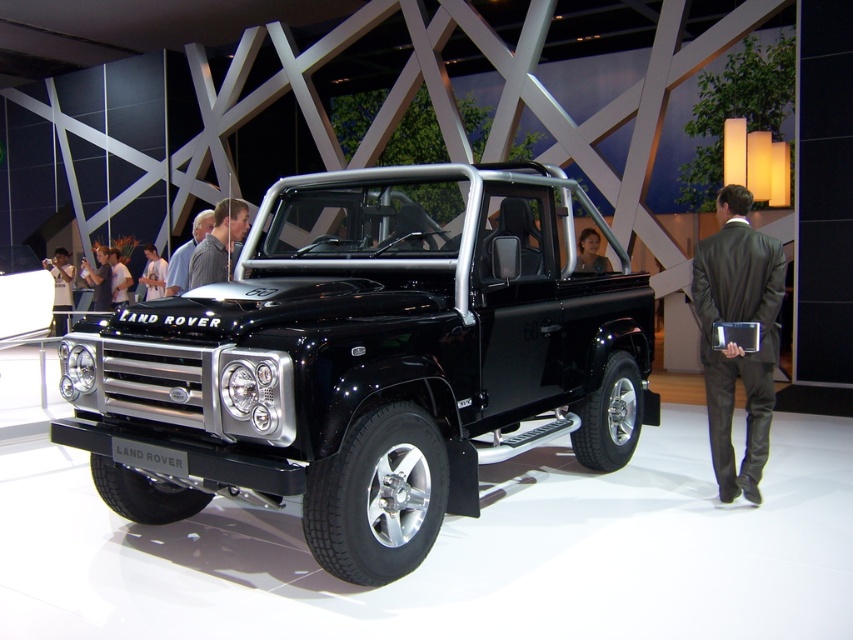
Measure the distance between gray striped shirt at center and white shirt at center.

A distance of 5.92 meters exists between gray striped shirt at center and white shirt at center.

Can you confirm if gray striped shirt at center is wider than white shirt at center?

Correct, the width of gray striped shirt at center exceeds that of white shirt at center.

Does point (164, 292) come in front of point (119, 298)?

Yes, it is.

You are a GUI agent. You are given a task and a screenshot of the screen. Output one action in this format:
    pyautogui.click(x=<x>, y=<y>)
    Task: Click on the gray striped shirt at center
    Image resolution: width=853 pixels, height=640 pixels.
    Given the screenshot: What is the action you would take?
    pyautogui.click(x=186, y=253)

In the scene shown: Between dark gray suit at right and white shirt at center, which one appears on the right side from the viewer's perspective?

Positioned to the right is dark gray suit at right.

Can you confirm if dark gray suit at right is taller than white shirt at center?

Yes.

Is point (761, 332) behind point (117, 264)?

No, (761, 332) is in front of (117, 264).

Where is `dark gray suit at right`? The height and width of the screenshot is (640, 853). dark gray suit at right is located at coordinates (735, 339).

Can you confirm if white fabric shirt at upper left is shorter than white shirt at center?

No.

Is white fabric shirt at upper left positioned before white shirt at center?

No, it is not.

Between point (62, 320) and point (114, 285), which one is positioned in front?

Point (114, 285) is in front.

The width and height of the screenshot is (853, 640). Identify the location of white fabric shirt at upper left. (61, 278).